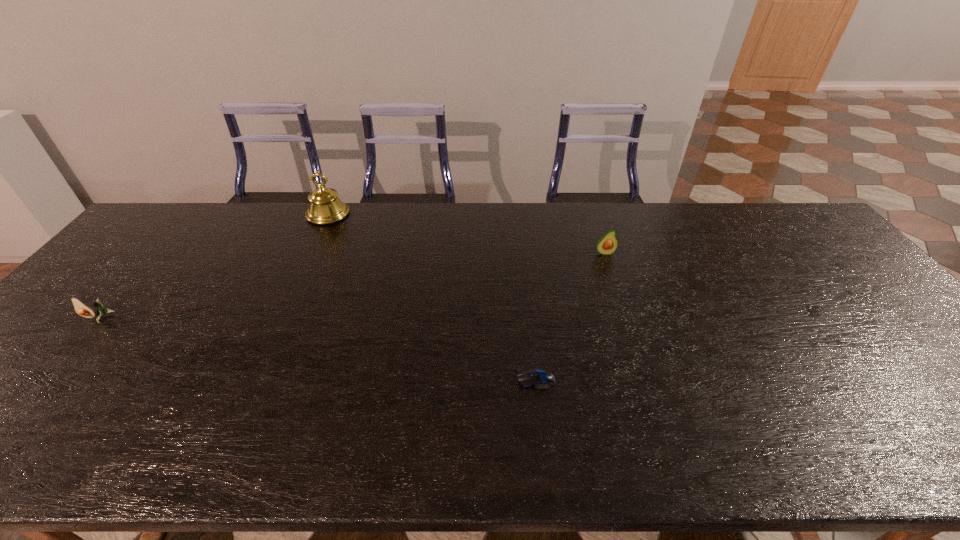
Where is `the closest object to the tallest object`? The image size is (960, 540). the closest object to the tallest object is located at coordinates (82, 307).

Choose which object is the nearest neighbor to the leftmost object. Please provide its 2D coordinates. Your answer should be formatted as a tuple, i.e. [(x, y)], where the tuple contains the x and y coordinates of a point satisfying the conditions above.

[(325, 207)]

Locate an element on the screen. The image size is (960, 540). vacant space that satisfies the following two spatial constraints: 1. on the cut side of the third nearest object; 2. on the button side of the third object from left to right is located at coordinates (646, 380).

Locate an element on the screen. vacant space that satisfies the following two spatial constraints: 1. on the cut side of the rightmost object; 2. on the button side of the nearest object is located at coordinates (646, 380).